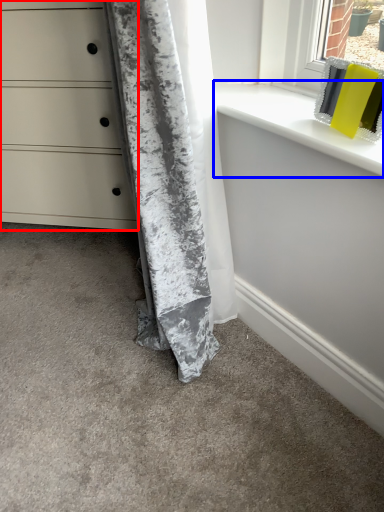
Question: Which object is further to the camera taking this photo, chest of drawers (highlighted by a red box) or window sill (highlighted by a blue box)?

Choices:
 (A) chest of drawers
 (B) window sill

Answer: (A)